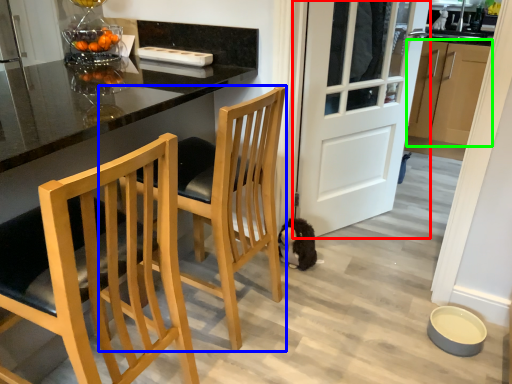
Question: Based on their relative distances, which object is nearer to door (highlighted by a red box)? Choose from chair (highlighted by a blue box) and cabinetry (highlighted by a green box).

Choices:
 (A) chair
 (B) cabinetry

Answer: (A)